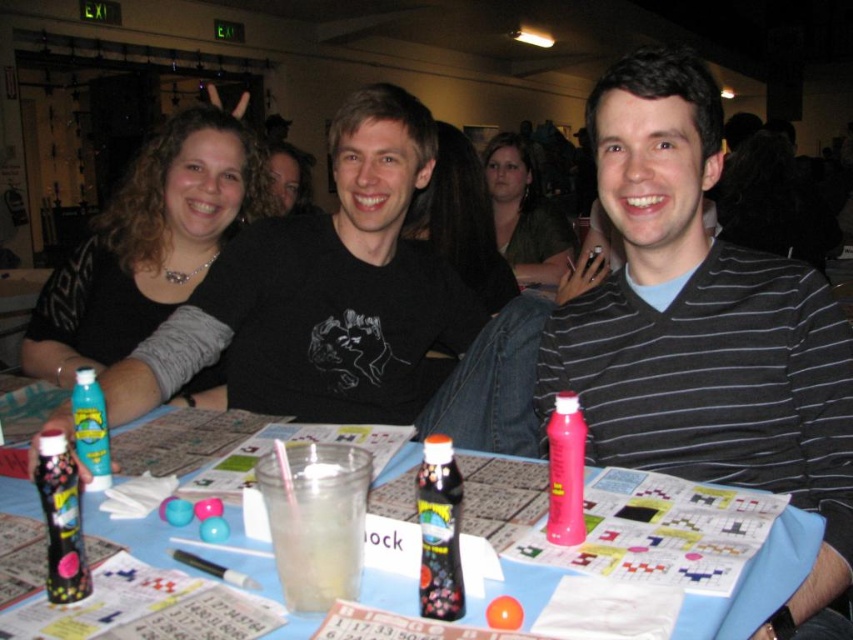
Question: Is striped cotton shirt at center to the left of shiny dark bottle at center from the viewer's perspective?

Choices:
 (A) yes
 (B) no

Answer: (B)

Question: Considering the relative positions of clear plastic cup at center and matte green shirt at center in the image provided, where is clear plastic cup at center located with respect to matte green shirt at center?

Choices:
 (A) left
 (B) right

Answer: (A)

Question: Which object is farther from the camera taking this photo?

Choices:
 (A) translucent plastic spray can at table center
 (B) clear plastic cup at center
 (C) matte black sweater at left

Answer: (C)

Question: In this image, where is striped cotton shirt at center located relative to clear plastic cup at center?

Choices:
 (A) left
 (B) right

Answer: (B)

Question: Which object is farther from the camera taking this photo?

Choices:
 (A) matte black sweater at left
 (B) shiny black spray can at table front
 (C) matte green shirt at center

Answer: (C)

Question: Which point is closer to the camera?

Choices:
 (A) shiny black spray can at table front
 (B) clear plastic cup at center
 (C) blue plastic bottle at center
 (D) striped cotton shirt at center

Answer: (C)